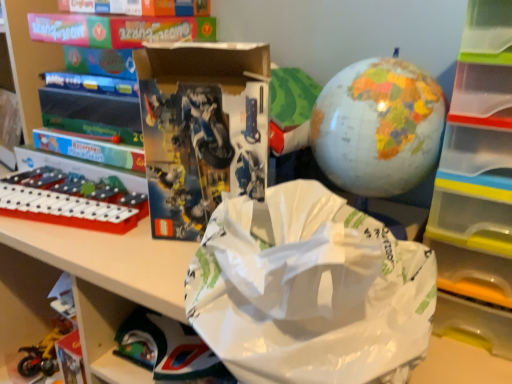
Locate an element on the screen. The image size is (512, 384). vacant area in front of matte black lego set at center is located at coordinates (161, 265).